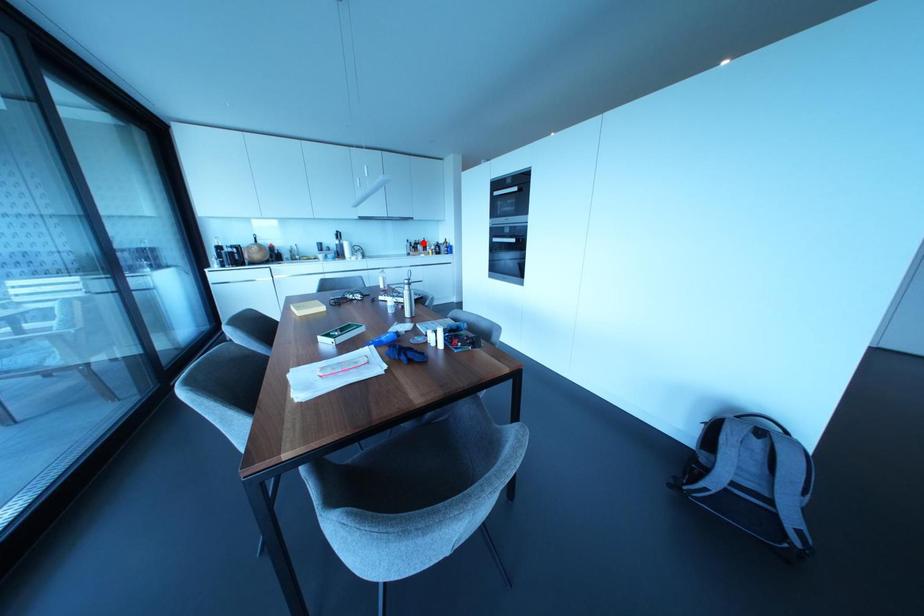
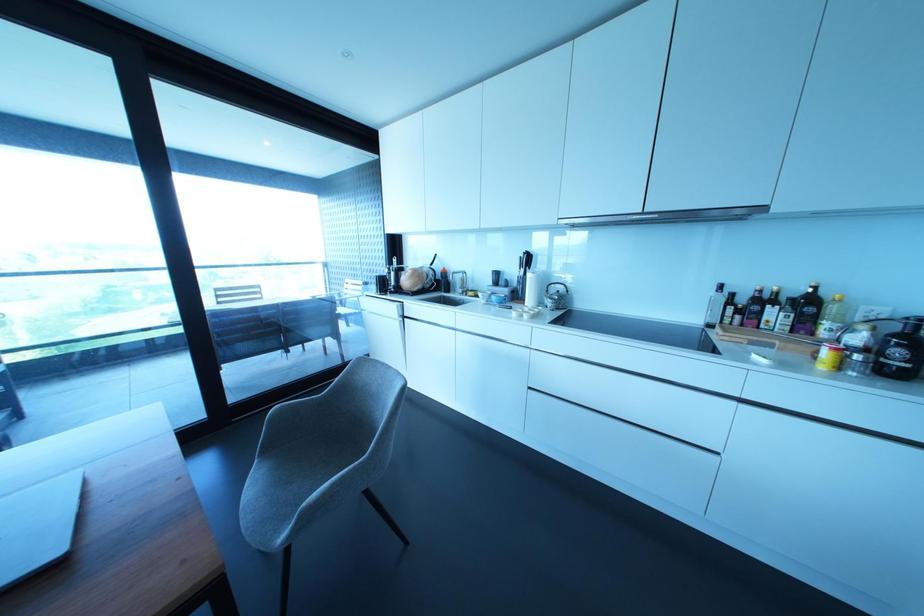
Locate, in the second image, the point that corresponds to the highlighted location in the first image.

(807, 304)